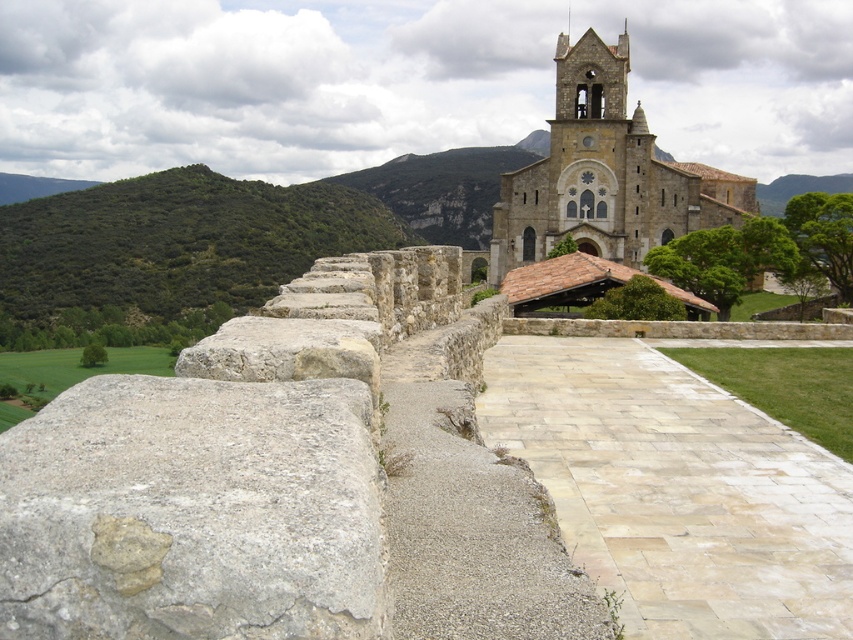
You are standing on the stone pathway leading to the stone church at center. You notice a gray rough stone at left near your feet. If you want to pick it up, which object is easier to reach?

The gray rough stone at left is closer to the viewer than the stone church at center, so it is easier to reach.

You are standing at the entrance of the historic stone church and looking towards the rolling hills. You notice a gray rough stone marked at point (192,512). Based on the scene description, where is this gray rough stone located relative to the church?

The gray rough stone at point (192,512) is located at the left side of the church, as indicated by the description stating it is at the left.